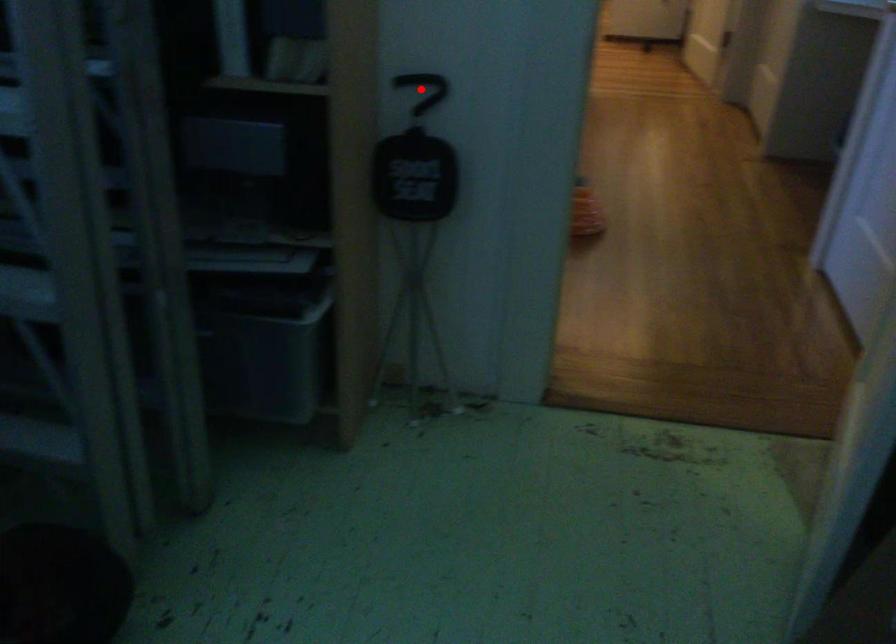
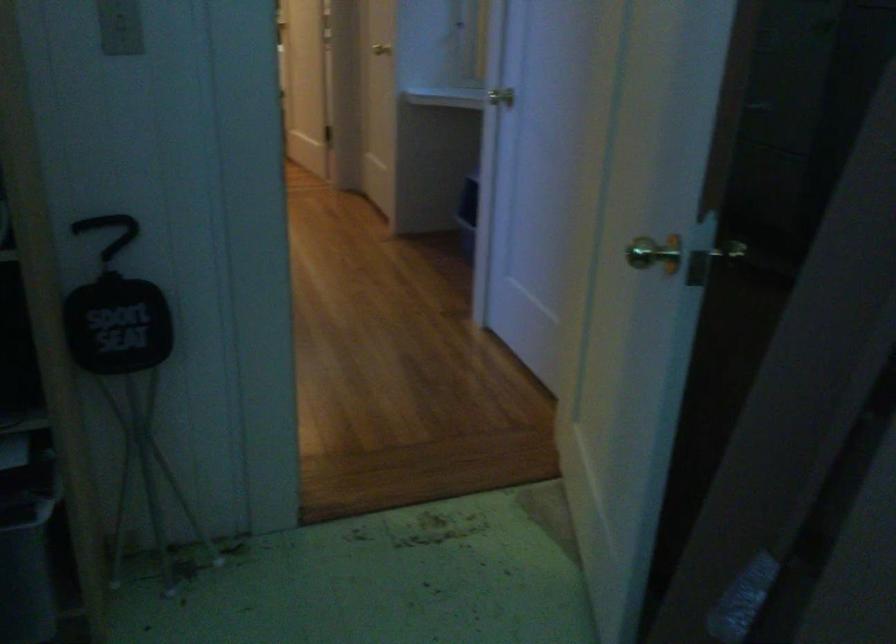
In the second image, find the point that corresponds to the highlighted location in the first image.

(108, 232)